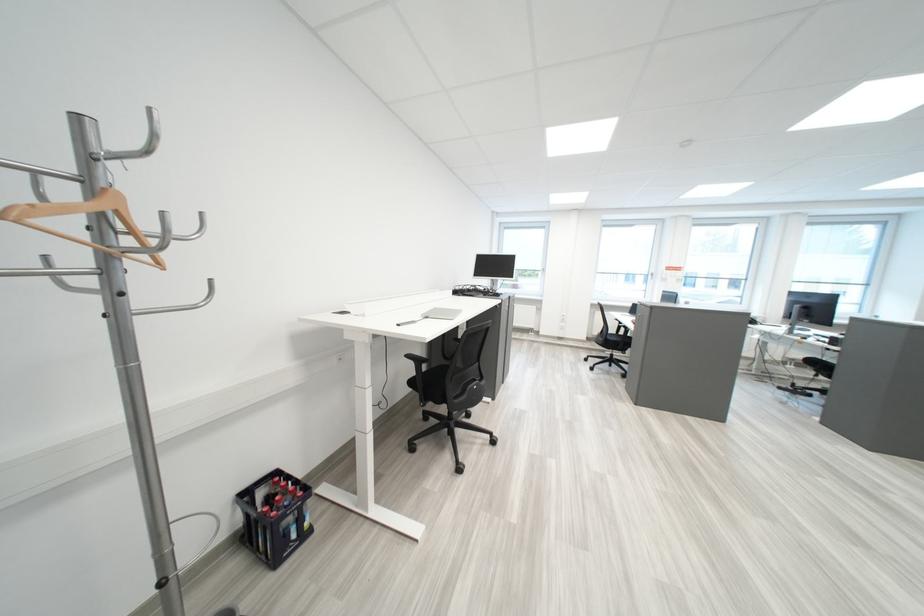
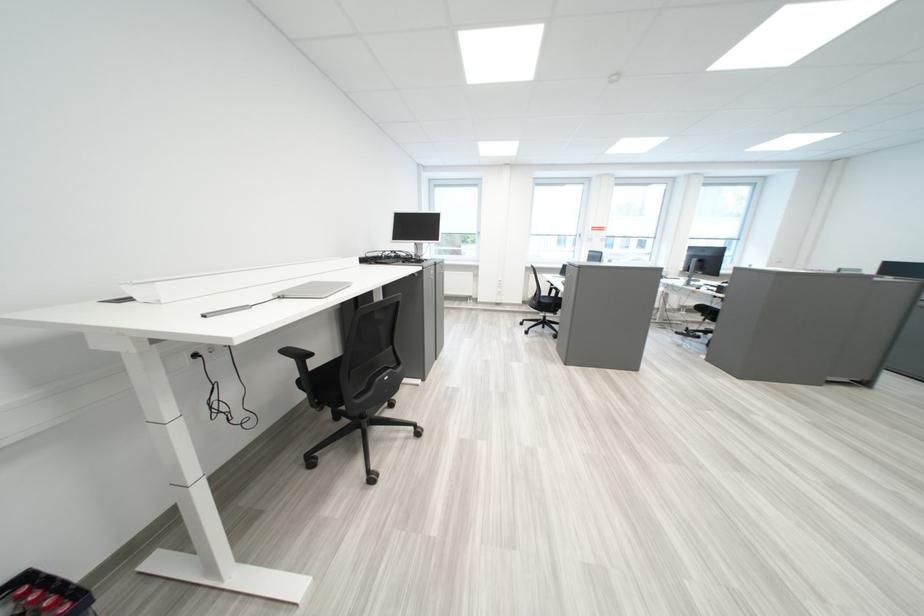
Question: The images are taken continuously from a first-person perspective. In which direction is your viewpoint rotating?

Choices:
 (A) Left
 (B) Right
 (C) Up
 (D) Down

Answer: (B)